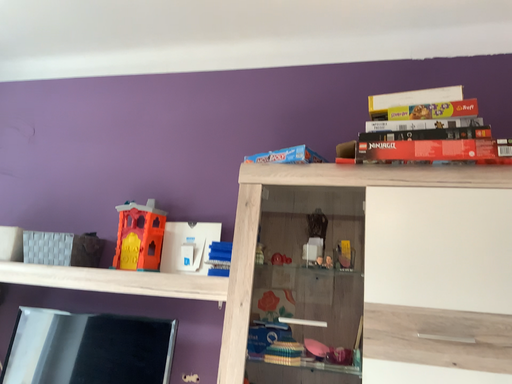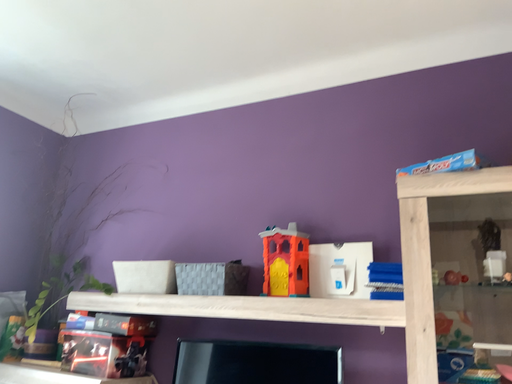
Question: Which way did the camera rotate in the video?

Choices:
 (A) rotated left
 (B) rotated right

Answer: (A)